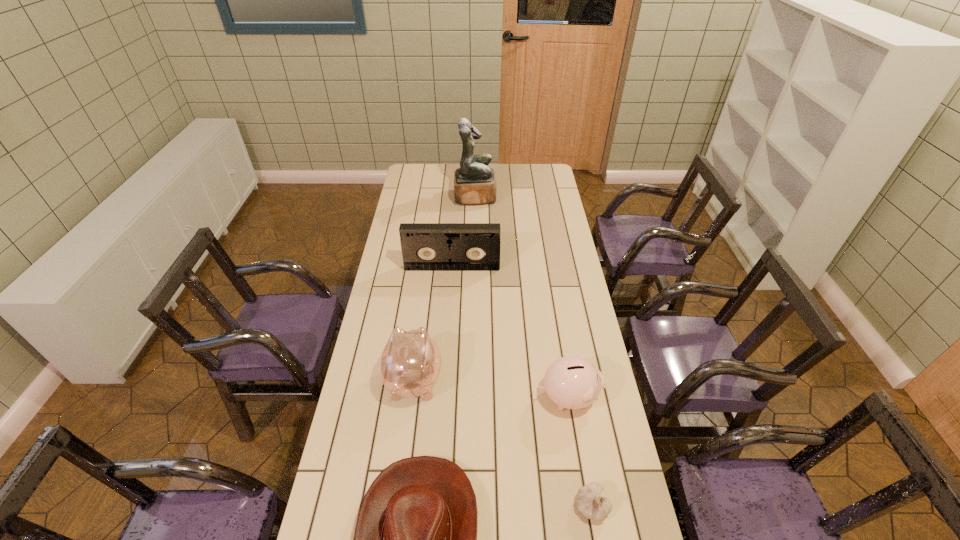
Locate an element on the screen. the tallest object is located at coordinates (474, 182).

You are a GUI agent. You are given a task and a screenshot of the screen. Output one action in this format:
    pyautogui.click(x=<x>, y=<y>)
    Task: Click on the sculpture
    This screenshot has width=960, height=540.
    Given the screenshot: What is the action you would take?
    pyautogui.click(x=474, y=182)

Find the location of a particular element. Image resolution: width=960 pixels, height=540 pixels. the second farthest object is located at coordinates (425, 246).

Where is `the taller piggy bank`? Image resolution: width=960 pixels, height=540 pixels. the taller piggy bank is located at coordinates (410, 363).

What are the coordinates of `the right piggy bank` in the screenshot? It's located at (572, 382).

You are a GUI agent. You are given a task and a screenshot of the screen. Output one action in this format:
    pyautogui.click(x=<x>, y=<y>)
    Task: Click on the third shortest object
    
    Given the screenshot: What is the action you would take?
    pyautogui.click(x=572, y=382)

This screenshot has height=540, width=960. Identify the location of garlic. (589, 502).

Locate an element on the screen. This screenshot has height=540, width=960. vacant region located in a relaxed pose on the farthest object is located at coordinates (519, 197).

Find the location of `vacant space located 0.360m on the front side of the second farthest object`. vacant space located 0.360m on the front side of the second farthest object is located at coordinates (447, 339).

At what (x,y) coordinates should I click in order to perform the action: click on vacant space situated 0.340m on the front facing side of the left piggy bank. Please return your answer as a coordinate pair (x, y). The height and width of the screenshot is (540, 960). Looking at the image, I should click on (426, 284).